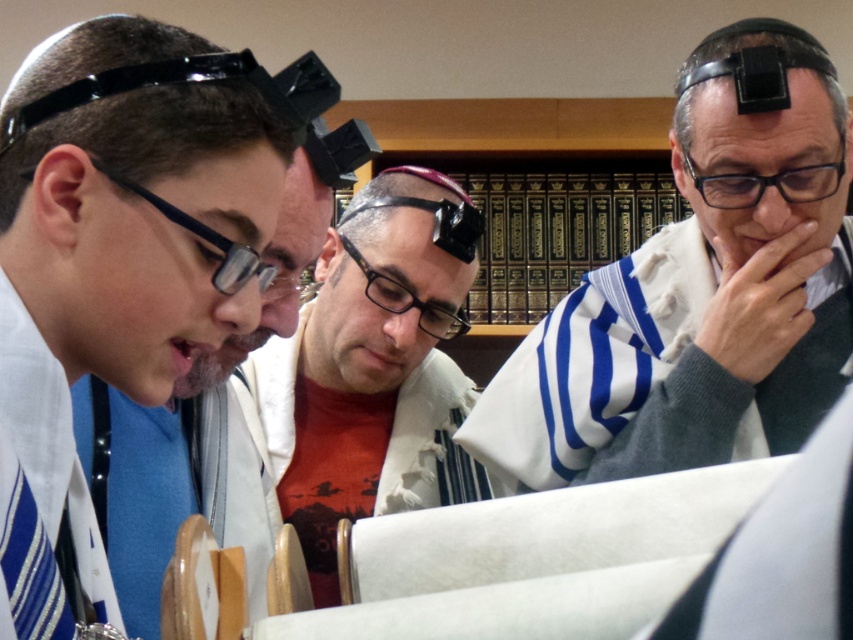
Between matte black glasses at center and blue striped tie at lower left, which one appears on the right side from the viewer's perspective?

matte black glasses at center

Is point (254, 352) positioned in front of point (9, 513)?

No, it is behind (9, 513).

At what (x,y) coordinates should I click in order to perform the action: click on matte black glasses at center. Please return your answer as a coordinate pair (x, y). This screenshot has width=853, height=640. Looking at the image, I should click on (368, 364).

Is point (62, 586) farther from camera compared to point (728, 192)?

No, (62, 586) is in front of (728, 192).

Who is positioned more to the left, blue striped tie at lower left or black plastic glasses at upper right?

blue striped tie at lower left is more to the left.

Which is in front, point (10, 529) or point (752, 202)?

Point (10, 529) is in front.

This screenshot has height=640, width=853. I want to click on blue striped tie at lower left, so (x=32, y=570).

Which is in front, point (219, 120) or point (35, 560)?

Positioned in front is point (35, 560).

Based on the photo, between white textured kippah at left and blue striped tie at lower left, which one has more height?

white textured kippah at left is taller.

Between point (71, 323) and point (22, 509), which one is positioned in front?

Positioned in front is point (22, 509).

The width and height of the screenshot is (853, 640). What are the coordinates of `white textured kippah at left` in the screenshot? It's located at (126, 250).